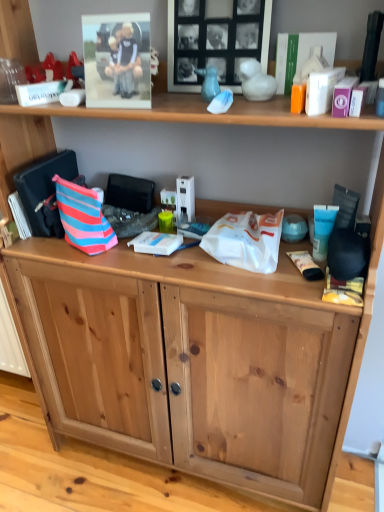
Describe the element at coordinates (246, 241) in the screenshot. I see `white plastic bag at center` at that location.

Describe the element at coordinates (189, 374) in the screenshot. This screenshot has width=384, height=512. I see `natural wood cabinet at lower center` at that location.

Identify the location of matte plastic photo frame at upper left, which is the 1th picture frame in left-to-right order. (117, 60).

Measure the distance between white matte book at upper right, arranged as the 3th book when ordered from the bottom, and camera.

white matte book at upper right, arranged as the 3th book when ordered from the bottom, is 34.65 inches from camera.

What do you see at coordinates (156, 243) in the screenshot?
I see `white plastic book at center, acting as the second book starting from the right` at bounding box center [156, 243].

At what (x,y) coordinates should I click in order to perform the action: click on striped fabric book at left, the first book from the left. Please return your answer as a coordinate pair (x, y). Image resolution: width=384 pixels, height=512 pixels. Looking at the image, I should click on click(x=19, y=215).

From the image's perspective, does blue cream tube at right appear lower than striped fabric book at left, the first book from the left?

Correct, blue cream tube at right appears lower than striped fabric book at left, the first book from the left, in the image.

You are a GUI agent. You are given a task and a screenshot of the screen. Output one action in this format:
    pyautogui.click(x=<x>, y=<y>)
    Task: Click on the 2nd book behind the blue cream tube at right
    Image resolution: width=384 pixels, height=512 pixels.
    Given the screenshot: What is the action you would take?
    pyautogui.click(x=19, y=215)

Is blue cream tube at right outside of striped fabric book at left, the first book from the left?

Absolutely, blue cream tube at right is external to striped fabric book at left, the first book from the left.

Is white plastic book at center, the 2th book from the left, with striped fabric messenger bag at left?

white plastic book at center, the 2th book from the left, and striped fabric messenger bag at left are clearly separated.

Considering the points (148, 248) and (82, 182), which point is behind, point (148, 248) or point (82, 182)?

The point (82, 182) is more distant.

What's the angular difference between white plastic book at center, acting as the second book starting from the right, and striped fabric messenger bag at left's facing directions?

1.58 degrees.

Consider the image. Which object is thinner, white plastic book at center, the 2th book from the left, or striped fabric messenger bag at left?

white plastic book at center, the 2th book from the left, is thinner.

From a real-world perspective, starting from the white plastic book at center, acting as the second book starting from the right, which book is the 2nd one vertically above it? Please provide its 2D coordinates.

[(300, 56)]

Between white matte book at upper right, arranged as the 3th book when ordered from the bottom, and white plastic book at center, acting as the second book starting from the right, which one has more height?

white matte book at upper right, arranged as the 3th book when ordered from the bottom, is taller.

Could you tell me if white matte book at upper right, which is the first book in top-to-bottom order, is facing white plastic book at center, the 2th book from the left?

No, white matte book at upper right, which is the first book in top-to-bottom order, does not turn towards white plastic book at center, the 2th book from the left.

Does striped fabric book at left, which ranks as the second book in top-to-bottom order, touch white plastic bag at center?

They are not placed beside each other.

From a real-world perspective, who is located higher, striped fabric book at left, the first book from the left, or white plastic bag at center?

striped fabric book at left, the first book from the left.

Does striped fabric book at left, the third book when ordered from right to left, have a larger size compared to white plastic bag at center?

No, striped fabric book at left, the third book when ordered from right to left, is not bigger than white plastic bag at center.

Is white plastic book at center, positioned as the first book in bottom-to-top order, oriented towards matte plastic photo frame at upper left, the second picture frame in the right-to-left sequence?

No, white plastic book at center, positioned as the first book in bottom-to-top order, is not facing towards matte plastic photo frame at upper left, the second picture frame in the right-to-left sequence.

How many degrees apart are the facing directions of white plastic book at center, the 2th book from the left, and matte plastic photo frame at upper left, the second picture frame in the right-to-left sequence?

The angle between the facing direction of white plastic book at center, the 2th book from the left, and the facing direction of matte plastic photo frame at upper left, the second picture frame in the right-to-left sequence, is 7.03 degrees.

Considering the positions of points (153, 251) and (144, 40), is point (153, 251) farther from camera compared to point (144, 40)?

Yes, point (153, 251) is farther from viewer.

From the image's perspective, which one is positioned higher, white plastic book at center, positioned as the first book in bottom-to-top order, or matte plastic photo frame at upper left, which is the 1th picture frame in left-to-right order?

matte plastic photo frame at upper left, which is the 1th picture frame in left-to-right order, appears higher in the image.

Identify the location of book that is above the striped fabric messenger bag at left (from a real-world perspective). (300, 56).

Considering the relative positions of striped fabric messenger bag at left and white matte book at upper right, marked as the 3th book in a left-to-right arrangement, in the image provided, is striped fabric messenger bag at left to the right of white matte book at upper right, marked as the 3th book in a left-to-right arrangement, from the viewer's perspective?

In fact, striped fabric messenger bag at left is to the left of white matte book at upper right, marked as the 3th book in a left-to-right arrangement.

Does striped fabric messenger bag at left turn towards white matte book at upper right, the 1th book viewed from the right?

No.

Is striped fabric messenger bag at left far from white matte book at upper right, arranged as the 3th book when ordered from the bottom?

No, striped fabric messenger bag at left is not far from white matte book at upper right, arranged as the 3th book when ordered from the bottom.

Is striped fabric messenger bag at left turned away from blue cream tube at right?

No, striped fabric messenger bag at left is not facing away from blue cream tube at right.

From the picture: Considering the relative sizes of striped fabric messenger bag at left and blue cream tube at right in the image provided, is striped fabric messenger bag at left shorter than blue cream tube at right?

Incorrect, the height of striped fabric messenger bag at left does not fall short of that of blue cream tube at right.

Between striped fabric messenger bag at left and blue cream tube at right, which one appears on the left side from the viewer's perspective?

striped fabric messenger bag at left is more to the left.

Which object is closer to the camera taking this photo, striped fabric messenger bag at left or blue cream tube at right?

blue cream tube at right is more forward.

The image size is (384, 512). What are the coordinates of `toiletry below the striped fabric book at left, which ranks as the second book in top-to-bottom order (from a real-world perspective)` in the screenshot? It's located at (323, 229).

The height and width of the screenshot is (512, 384). Identify the location of messenger bag that is above the white plastic book at center, the 2th book from the left (from a real-world perspective). (46, 191).

Based on their spatial positions, is matte plastic photo frame at upper left, which is the 1th picture frame in left-to-right order, or striped fabric messenger bag at left further from striped fabric book at left, the first book from the left?

Among the two, matte plastic photo frame at upper left, which is the 1th picture frame in left-to-right order, is located further to striped fabric book at left, the first book from the left.

Estimate the real-world distances between objects in this image. Which object is closer to blue cream tube at right, white plastic book at center, which is the 3th book in top-to-bottom order, or striped fabric messenger bag at left?

Based on the image, white plastic book at center, which is the 3th book in top-to-bottom order, appears to be nearer to blue cream tube at right.

Which object lies nearer to the anchor point striped fabric book at left, the first book from the left, striped fabric handbag at left or white plastic bag at center?

striped fabric handbag at left is closer to striped fabric book at left, the first book from the left.

Which object lies nearer to the anchor point striped fabric handbag at left, blue cream tube at right or striped fabric book at left, the first book from the left?

The object closer to striped fabric handbag at left is striped fabric book at left, the first book from the left.

When comparing their distances from striped fabric handbag at left, does striped fabric messenger bag at left or black matte picture frame at upper center, positioned as the first picture frame in right-to-left order, seem closer?

The object closer to striped fabric handbag at left is striped fabric messenger bag at left.

From the image, which object appears to be farther from matte plastic photo frame at upper left, which is the 1th picture frame in left-to-right order, white matte book at upper right, the 1th book viewed from the right, or white plastic bag at center?

The object further to matte plastic photo frame at upper left, which is the 1th picture frame in left-to-right order, is white plastic bag at center.

Based on the photo, which object lies further to the anchor point blue cream tube at right, white matte book at upper right, marked as the 3th book in a left-to-right arrangement, or striped fabric handbag at left?

The object further to blue cream tube at right is striped fabric handbag at left.

From the image, which object appears to be farther from natural wood cabinet at lower center, black matte picture frame at upper center, positioned as the first picture frame in right-to-left order, or white plastic book at center, the 2th book from the left?

The object further to natural wood cabinet at lower center is black matte picture frame at upper center, positioned as the first picture frame in right-to-left order.

Find the location of a particular element. This screenshot has width=384, height=512. messenger bag between black matte picture frame at upper center, which is the second picture frame from left to right, and white plastic book at center, the 2th book from the left, from top to bottom is located at coordinates (46, 191).

Image resolution: width=384 pixels, height=512 pixels. Identify the location of picture frame between black matte picture frame at upper center, positioned as the first picture frame in right-to-left order, and white plastic book at center, positioned as the first book in bottom-to-top order, from top to bottom. (117, 60).

You are a GUI agent. You are given a task and a screenshot of the screen. Output one action in this format:
    pyautogui.click(x=<x>, y=<y>)
    Task: Click on the toiletry between black matte picture frame at upper center, positioned as the first picture frame in right-to-left order, and white plastic book at center, positioned as the first book in bottom-to-top order, in the up-down direction
    
    Given the screenshot: What is the action you would take?
    pyautogui.click(x=323, y=229)

Locate an element on the screen. This screenshot has width=384, height=512. messenger bag that lies between matte plastic photo frame at upper left, which is the 1th picture frame in left-to-right order, and white plastic book at center, which is the 3th book in top-to-bottom order, from top to bottom is located at coordinates (46, 191).